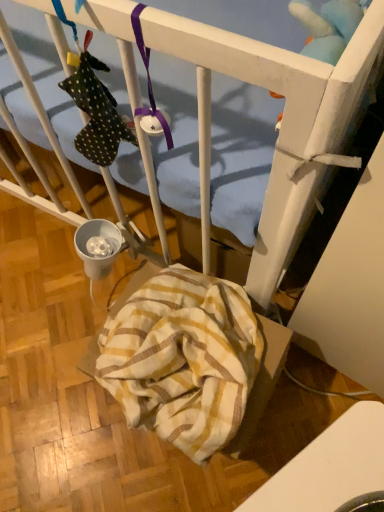
You are a GUI agent. You are given a task and a screenshot of the screen. Output one action in this format:
    pyautogui.click(x=<x>, y=<y>)
    Task: Click on the unoccupied space behind white glossy table at lower right
    
    Given the screenshot: What is the action you would take?
    pyautogui.click(x=304, y=404)